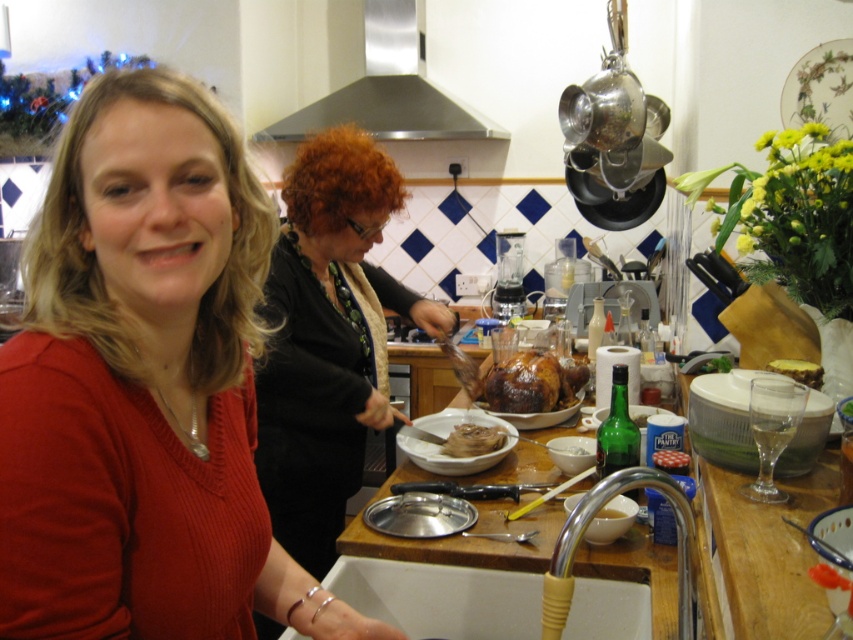
You are a chef who needs to place the brown matte food at center into the white ceramic sink at lower center. Considering their heights, will the food fit inside the sink without any adjustments?

The white ceramic sink at lower center is taller than the brown matte food at center, so the food will fit inside the sink without needing any adjustments.

You are standing in the kitchen and want to reach the point at coordinates point (540, 388). To do so, you must first pass through point (503, 435). Is this necessary?

Yes, because point (540, 388) is behind point (503, 435), so you need to go through point (503, 435) first to reach it.